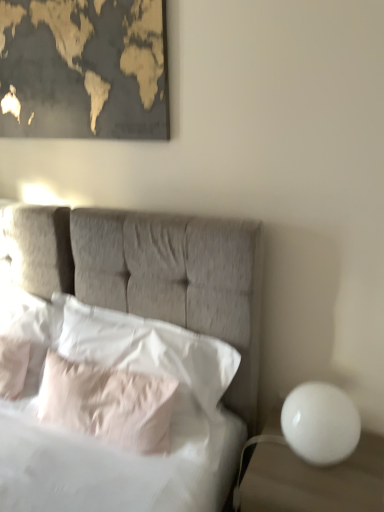
Question: From the image's perspective, is white soft pillow at left, which ranks as the second pillow in left-to-right order, positioned above or below white glossy sphere at right?

Choices:
 (A) above
 (B) below

Answer: (A)

Question: In terms of height, does white soft pillow at left, which ranks as the second pillow in left-to-right order, look taller or shorter compared to white glossy sphere at right?

Choices:
 (A) short
 (B) tall

Answer: (A)

Question: Which object is the farthest from the white soft pillow at left, positioned as the first pillow in left-to-right order?

Choices:
 (A) gold-toned matte map at upper left
 (B) pale pink fabric pillow at center, which is counted as the third pillow, starting from the left
 (C) white soft pillow at left, which appears as the 3th pillow when viewed from the right
 (D) white glossy sphere at right
 (E) white glossy sphere at right

Answer: (E)

Question: Estimate the real-world distances between objects in this image. Which object is farther from the gold-toned matte map at upper left?

Choices:
 (A) white glossy sphere at right
 (B) white soft pillow at left, positioned as the first pillow in left-to-right order
 (C) white soft pillow at center, the 1th pillow viewed from the right
 (D) pale pink fabric pillow at center, the second pillow when ordered from right to left
 (E) white soft pillow at left, which appears as the 3th pillow when viewed from the right

Answer: (A)